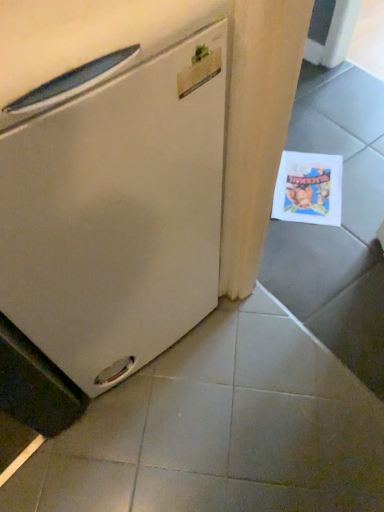
Question: Is printed paper postcard at lower right to the left of white matte refrigerator at left from the viewer's perspective?

Choices:
 (A) yes
 (B) no

Answer: (B)

Question: Could white matte refrigerator at left be considered to be inside printed paper postcard at lower right?

Choices:
 (A) yes
 (B) no

Answer: (B)

Question: From the image's perspective, is printed paper postcard at lower right above white matte refrigerator at left?

Choices:
 (A) no
 (B) yes

Answer: (B)

Question: Considering the relative sizes of printed paper postcard at lower right and white matte refrigerator at left in the image provided, is printed paper postcard at lower right bigger than white matte refrigerator at left?

Choices:
 (A) yes
 (B) no

Answer: (B)

Question: Considering the relative sizes of printed paper postcard at lower right and white matte refrigerator at left in the image provided, is printed paper postcard at lower right thinner than white matte refrigerator at left?

Choices:
 (A) no
 (B) yes

Answer: (B)

Question: From a real-world perspective, is printed paper postcard at lower right under white matte refrigerator at left?

Choices:
 (A) no
 (B) yes

Answer: (B)

Question: Is printed paper postcard at lower right outside gray matte tile at lower center?

Choices:
 (A) yes
 (B) no

Answer: (A)

Question: Is printed paper postcard at lower right at the left side of gray matte tile at lower center?

Choices:
 (A) yes
 (B) no

Answer: (B)

Question: Considering the relative sizes of printed paper postcard at lower right and gray matte tile at lower center in the image provided, is printed paper postcard at lower right thinner than gray matte tile at lower center?

Choices:
 (A) yes
 (B) no

Answer: (A)

Question: From the image's perspective, is printed paper postcard at lower right under gray matte tile at lower center?

Choices:
 (A) no
 (B) yes

Answer: (A)

Question: Is printed paper postcard at lower right turned away from gray matte tile at lower center?

Choices:
 (A) no
 (B) yes

Answer: (A)

Question: Considering the relative sizes of printed paper postcard at lower right and gray matte tile at lower center in the image provided, is printed paper postcard at lower right taller than gray matte tile at lower center?

Choices:
 (A) no
 (B) yes

Answer: (A)

Question: From a real-world perspective, does gray matte tile at lower center stand above white matte refrigerator at left?

Choices:
 (A) no
 (B) yes

Answer: (A)